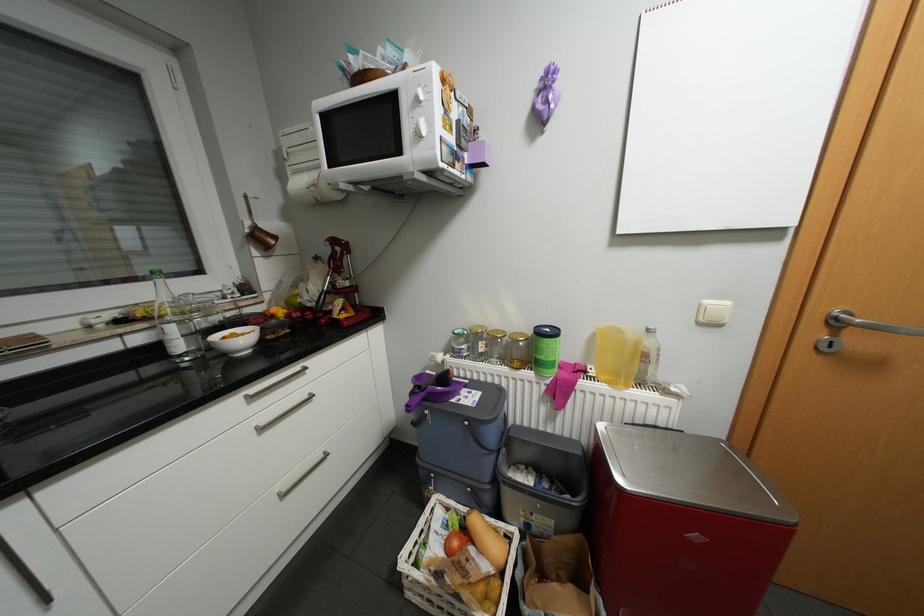
Where would you lift the purple handle? Please return your answer as a coordinate pair (x, y).

(416, 399)